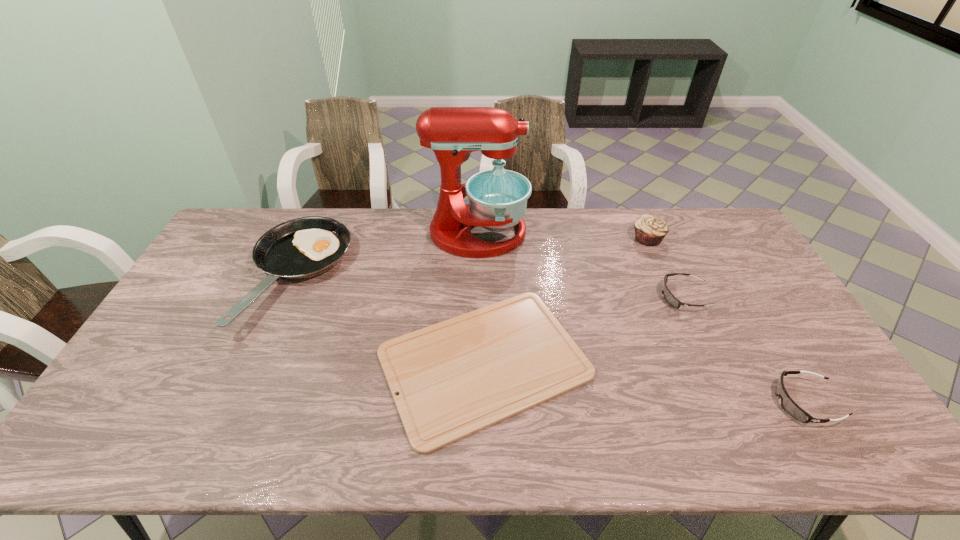
Identify the location of the tallest object. This screenshot has height=540, width=960. (498, 198).

Locate an element on the screen. The height and width of the screenshot is (540, 960). the second tallest object is located at coordinates (650, 230).

I want to click on frying pan, so click(x=301, y=248).

You are a GUI agent. You are given a task and a screenshot of the screen. Output one action in this format:
    pyautogui.click(x=<x>, y=<y>)
    Task: Click on the third tallest object
    This screenshot has height=540, width=960.
    Given the screenshot: What is the action you would take?
    pyautogui.click(x=301, y=248)

You are a GUI agent. You are given a task and a screenshot of the screen. Output one action in this format:
    pyautogui.click(x=<x>, y=<y>)
    Task: Click on the farther goggles
    Image resolution: width=960 pixels, height=540 pixels.
    Given the screenshot: What is the action you would take?
    pyautogui.click(x=668, y=296)

Find the location of a particular element. The image size is (960, 540). the rightmost object is located at coordinates (790, 407).

Find the location of a particular element. The image size is (960, 540). the right goggles is located at coordinates (790, 407).

Find the location of a particular element. the shortest object is located at coordinates (454, 378).

Find the location of a particular element. This screenshot has width=960, height=540. free space located on the front-facing side of the mixer is located at coordinates (636, 234).

Image resolution: width=960 pixels, height=540 pixels. What are the coordinates of `free space located 0.300m on the left of the fifth shortest object` in the screenshot? It's located at (547, 238).